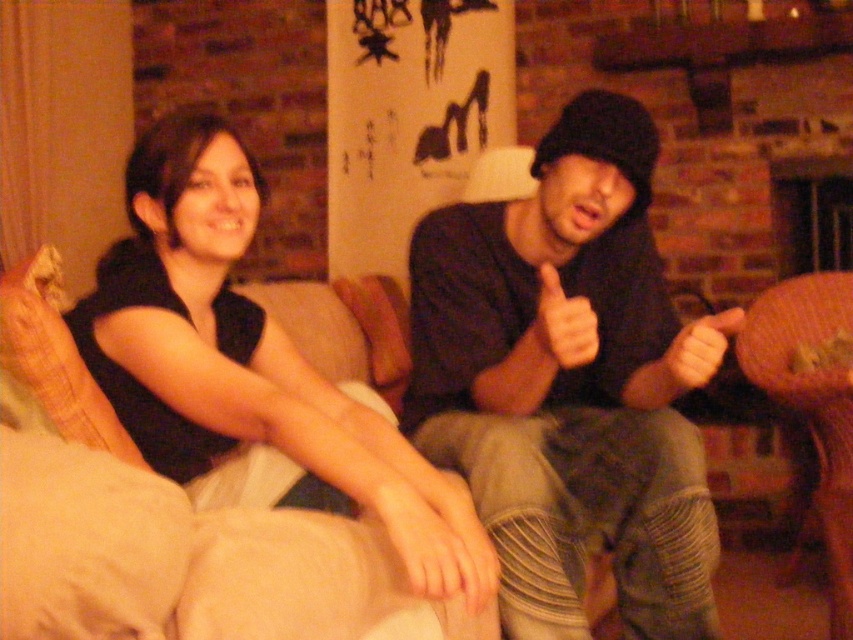
Is black matte hoodie at upper center behind brown woven armchair at lower right?

No, it is not.

Image resolution: width=853 pixels, height=640 pixels. What do you see at coordinates (439, 381) in the screenshot?
I see `black matte hoodie at upper center` at bounding box center [439, 381].

Is point (599, 177) more distant than point (840, 580)?

No, (599, 177) is closer to viewer.

Where is `black matte hoodie at upper center`? This screenshot has width=853, height=640. black matte hoodie at upper center is located at coordinates (439, 381).

Is dark gray hoodie at center further to the viewer compared to brown woven armchair at lower right?

That is False.

Which is above, dark gray hoodie at center or brown woven armchair at lower right?

Positioned higher is dark gray hoodie at center.

Between point (669, 428) and point (781, 292), which one is positioned in front?

Point (669, 428)

The image size is (853, 640). What are the coordinates of `dark gray hoodie at center` in the screenshot? It's located at (566, 387).

Who is higher up, brown woven armchair at lower right or smooth skin hand at center?

smooth skin hand at center is above.

Does brown woven armchair at lower right have a lesser height compared to smooth skin hand at center?

In fact, brown woven armchair at lower right may be taller than smooth skin hand at center.

Locate an element on the screen. brown woven armchair at lower right is located at coordinates (811, 400).